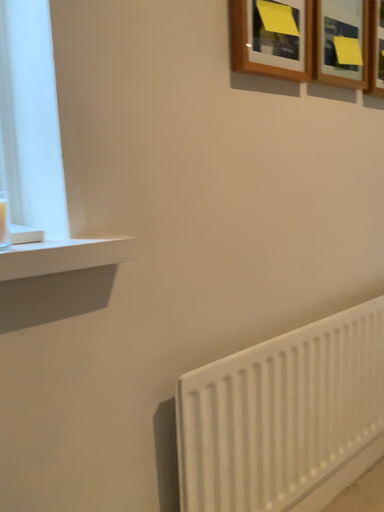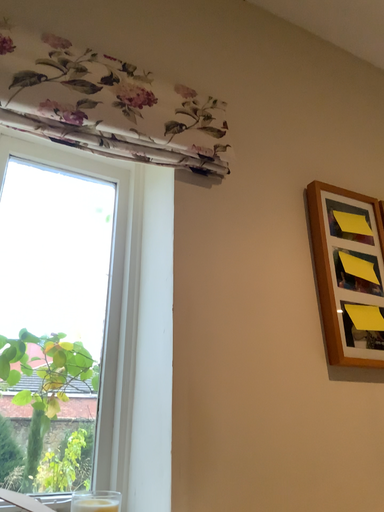
Question: Which way did the camera rotate in the video?

Choices:
 (A) rotated right
 (B) rotated left

Answer: (B)